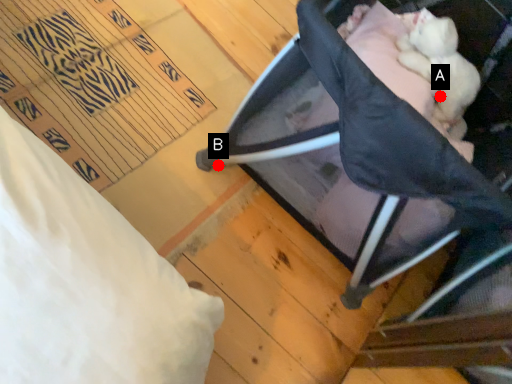
Question: Two points are circled on the image, labeled by A and B beside each circle. Which point is closer to the camera taking this photo?

Choices:
 (A) A is closer
 (B) B is closer

Answer: (B)